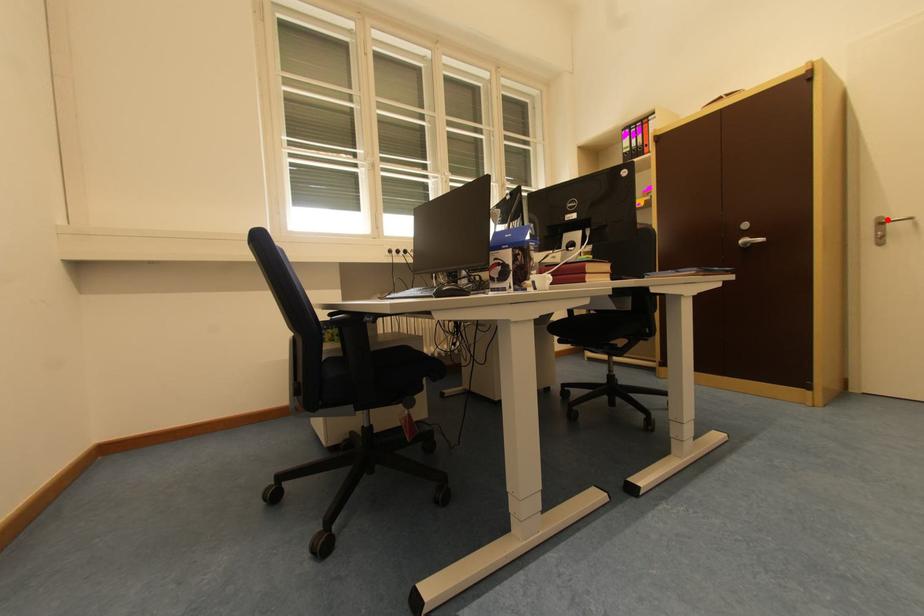
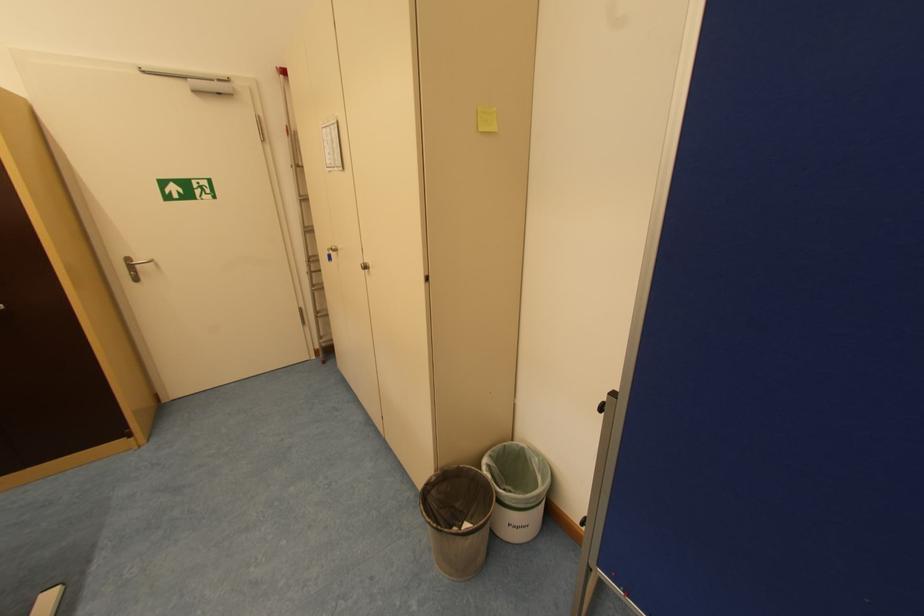
Question: I am providing you with two images of the same scene from different viewpoints. Image1 has a red point marked. In image2, the corresponding 3D location appears at what relative position? Reply with the corresponding letter.

Choices:
 (A) Closer
 (B) Farther

Answer: (A)